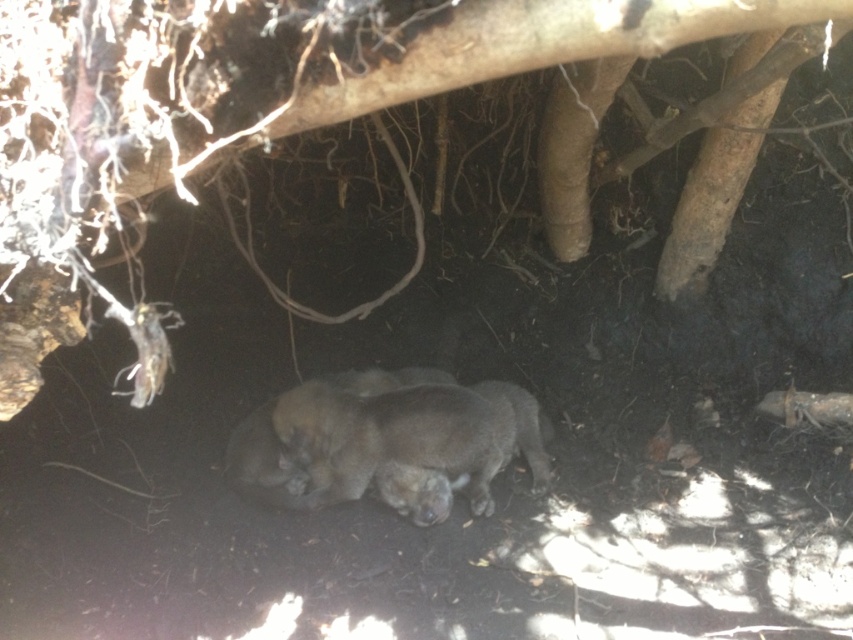
Does point (592, 26) lie behind point (401, 403)?

No, it is in front of (401, 403).

Between brown rough tree trunk at center and fuzzy gray animal at center, which one has less height?

Standing shorter between the two is fuzzy gray animal at center.

Is point (509, 8) positioned behind point (471, 486)?

No, (509, 8) is in front of (471, 486).

Where is `brown rough tree trunk at center`? The width and height of the screenshot is (853, 640). brown rough tree trunk at center is located at coordinates (538, 44).